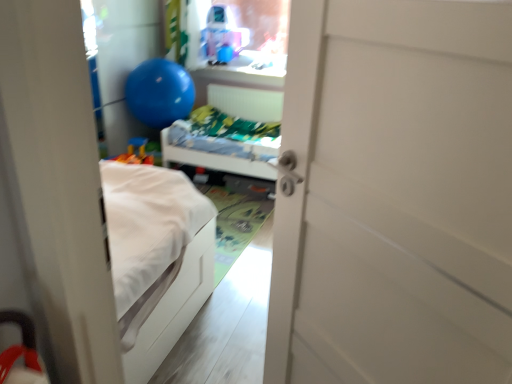
Question: Is white matte door at center bigger or smaller than blue rubber balloon at upper left?

Choices:
 (A) big
 (B) small

Answer: (B)

Question: Is white matte door at center inside the boundaries of blue rubber balloon at upper left, or outside?

Choices:
 (A) outside
 (B) inside

Answer: (A)

Question: Considering the real-world distances, which object is closest to the blue rubber balloon at upper left?

Choices:
 (A) white matte hospital bed at center
 (B) translucent plastic toy at upper center
 (C) white matte door at center

Answer: (A)

Question: Based on their relative distances, which object is nearer to the white matte hospital bed at center?

Choices:
 (A) translucent plastic toy at upper center
 (B) white matte door at center
 (C) blue rubber balloon at upper left

Answer: (C)